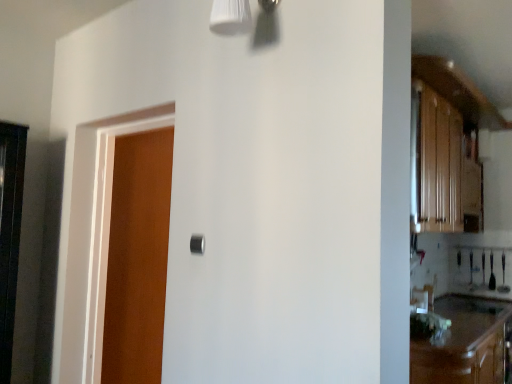
Question: From the image's perspective, is wooden door at left positioned above or below black matte door handle at center?

Choices:
 (A) below
 (B) above

Answer: (A)

Question: Is wooden door at left inside the boundaries of black matte door handle at center, or outside?

Choices:
 (A) inside
 (B) outside

Answer: (B)

Question: Which object is the closest to the black matte door handle at center?

Choices:
 (A) brown wood cabinetry at lower right
 (B) wooden door at left

Answer: (B)

Question: Which is farther from the black matte door handle at center?

Choices:
 (A) brown wood cabinetry at lower right
 (B) wooden door at left

Answer: (A)